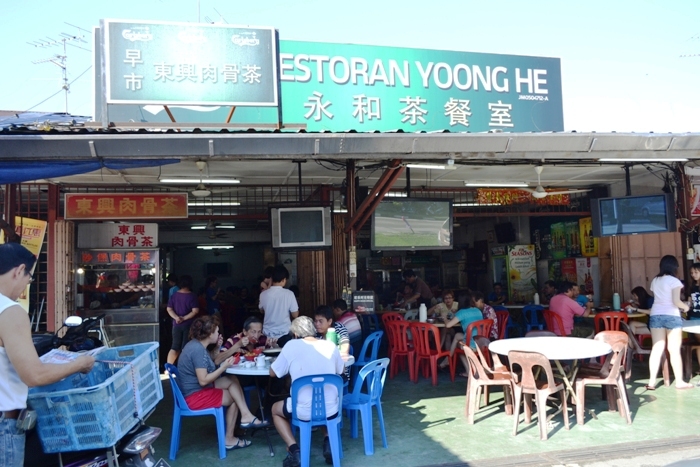
The width and height of the screenshot is (700, 467). Identify the location of television. pyautogui.click(x=616, y=218), pyautogui.click(x=392, y=213), pyautogui.click(x=302, y=231).